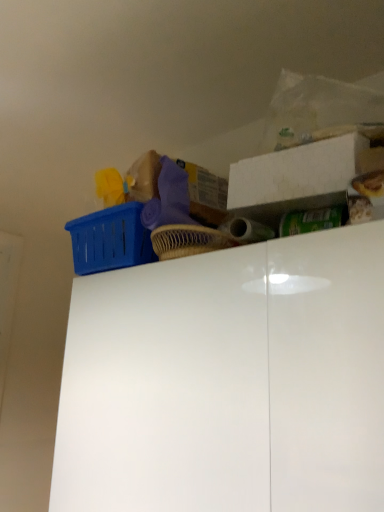
Question: From the image's perspective, is white glossy cabinet at upper center above or below white matte storage box at upper right?

Choices:
 (A) above
 (B) below

Answer: (B)

Question: In terms of size, does white glossy cabinet at upper center appear bigger or smaller than white matte storage box at upper right?

Choices:
 (A) small
 (B) big

Answer: (B)

Question: Is white glossy cabinet at upper center taller or shorter than white matte storage box at upper right?

Choices:
 (A) short
 (B) tall

Answer: (B)

Question: From the image's perspective, is white matte storage box at upper right positioned above or below white glossy cabinet at upper center?

Choices:
 (A) below
 (B) above

Answer: (B)

Question: Considering the positions of white matte storage box at upper right and white glossy cabinet at upper center in the image, is white matte storage box at upper right taller or shorter than white glossy cabinet at upper center?

Choices:
 (A) short
 (B) tall

Answer: (A)

Question: From a real-world perspective, is white matte storage box at upper right positioned above or below white glossy cabinet at upper center?

Choices:
 (A) above
 (B) below

Answer: (A)

Question: Does point (274, 152) appear closer or farther from the camera than point (311, 467)?

Choices:
 (A) closer
 (B) farther

Answer: (B)